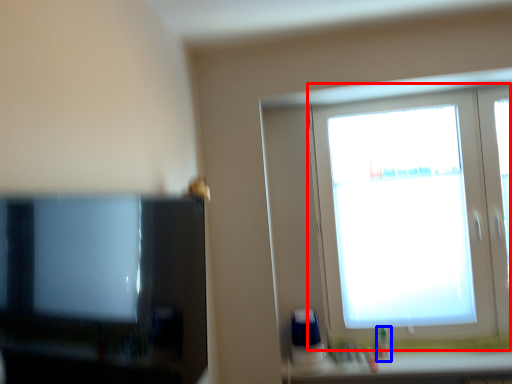
Question: Which point is further to the camera, window (highlighted by a red box) or toiletry (highlighted by a blue box)?

Choices:
 (A) window
 (B) toiletry

Answer: (B)